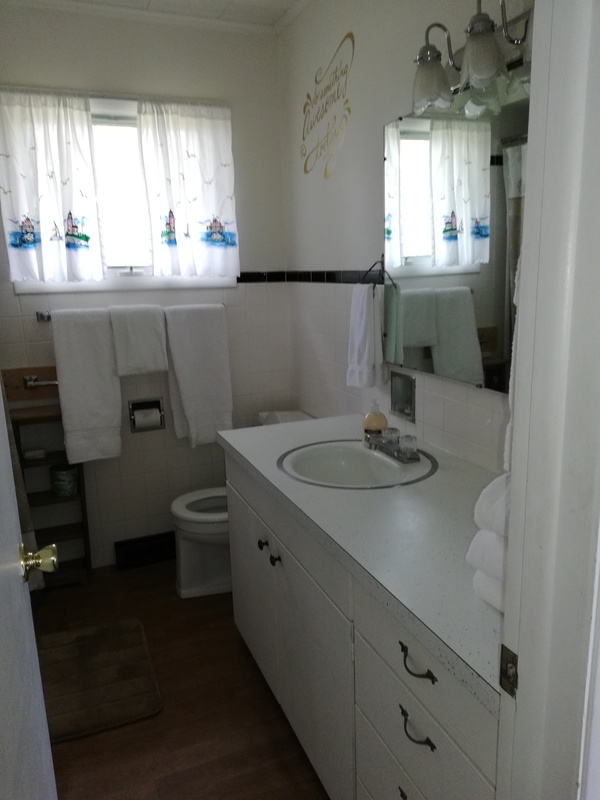
The height and width of the screenshot is (800, 600). Find the location of `tiled wall`. tiled wall is located at coordinates (317, 344), (265, 348).